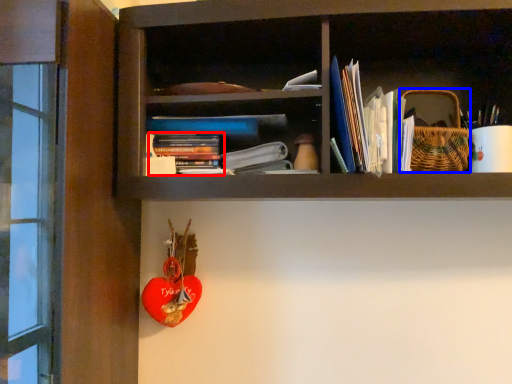
Question: Which object appears farthest to the camera in this image, book (highlighted by a red box) or basket (highlighted by a blue box)?

Choices:
 (A) book
 (B) basket

Answer: (A)